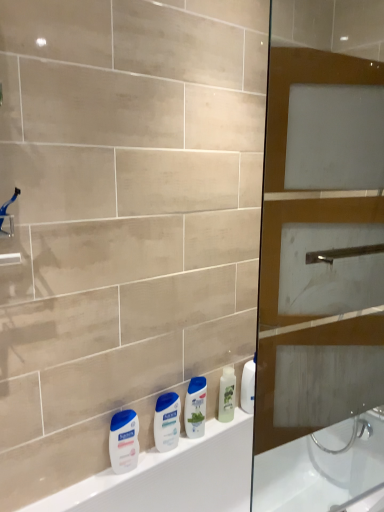
Measure the distance between point (342, 231) and camera.

Point (342, 231) and camera are 4.87 feet apart.

This screenshot has width=384, height=512. What do you see at coordinates (320, 282) in the screenshot?
I see `brown glass screen door at right` at bounding box center [320, 282].

The width and height of the screenshot is (384, 512). What do you see at coordinates (8, 214) in the screenshot? I see `blue plastic shower head at upper left` at bounding box center [8, 214].

Measure the distance between point (199, 384) and camera.

Point (199, 384) is 5.03 feet from camera.

The image size is (384, 512). Describe the element at coordinates (227, 395) in the screenshot. I see `white glossy lotion at center, which is the third toiletry from left to right` at that location.

What do you see at coordinates (167, 421) in the screenshot? I see `white glossy lotion at center, arranged as the second toiletry when viewed from the right` at bounding box center [167, 421].

Locate an element on the screen. This screenshot has height=512, width=384. brown glass screen door at right is located at coordinates (320, 282).

What's the angular difference between blue glossy shampoo at center and brown glass screen door at right's facing directions?

8.45 degrees.

Considering their positions, is blue glossy shampoo at center located in front of or behind brown glass screen door at right?

Clearly, blue glossy shampoo at center is behind brown glass screen door at right.

In the image, there is a brown glass screen door at right. Identify the location of cleaning product below it (from the image's perspective). The image size is (384, 512). (195, 407).

Considering the positions of point (15, 187) and point (132, 442), is point (15, 187) closer or farther from the camera than point (132, 442)?

Point (15, 187) is positioned closer to the camera compared to point (132, 442).

Can you confirm if blue plastic shower head at upper left is shorter than white matte lotion at lower left, which ranks as the 1th toiletry in left-to-right order?

Indeed, blue plastic shower head at upper left has a lesser height compared to white matte lotion at lower left, which ranks as the 1th toiletry in left-to-right order.

From a real-world perspective, who is located lower, blue plastic shower head at upper left or white matte lotion at lower left, the 3th toiletry positioned from the right?

From a 3D spatial view, white matte lotion at lower left, the 3th toiletry positioned from the right, is below.

Find the location of a particular element. The image size is (384, 512). shower on the left of white matte lotion at lower left, which ranks as the first toiletry in front-to-back order is located at coordinates (8, 214).

Which is closer, (124,412) or (228,420)?

Clearly, point (124,412) is closer to the camera than point (228,420).

Between white matte lotion at lower left, the third toiletry when ordered from back to front, and white glossy lotion at center, which is the first toiletry from right to left, which one has smaller width?

white glossy lotion at center, which is the first toiletry from right to left, is thinner.

From a real-world perspective, is white matte lotion at lower left, the 3th toiletry positioned from the right, physically below white glossy lotion at center, which is the third toiletry in front-to-back order?

Yes.

Can you tell me how much white matte lotion at lower left, the third toiletry when ordered from back to front, and white glossy lotion at center, the first toiletry viewed from the back, differ in facing direction?

There is a 0.00145-degree angle between the facing directions of white matte lotion at lower left, the third toiletry when ordered from back to front, and white glossy lotion at center, the first toiletry viewed from the back.

Do you think blue glossy shampoo at center is within blue plastic shower head at upper left, or outside of it?

The correct answer is: outside.

Based on the photo, from a real-world perspective, relative to blue plastic shower head at upper left, is blue glossy shampoo at center vertically above or below?

In terms of real-world spatial position, blue glossy shampoo at center is below blue plastic shower head at upper left.

Is blue glossy shampoo at center positioned with its back to blue plastic shower head at upper left?

No, blue glossy shampoo at center is not facing the opposite direction of blue plastic shower head at upper left.

Is blue glossy shampoo at center shorter than blue plastic shower head at upper left?

In fact, blue glossy shampoo at center may be taller than blue plastic shower head at upper left.

Is white glossy lotion at center, which is the third toiletry from left to right, oriented towards white glossy lotion at center, which is counted as the 2th toiletry, starting from the back?

No, white glossy lotion at center, which is the third toiletry from left to right, is not oriented towards white glossy lotion at center, which is counted as the 2th toiletry, starting from the back.

Is white glossy lotion at center, which is the third toiletry in front-to-back order, directly adjacent to white glossy lotion at center, marked as the 2th toiletry in a front-to-back arrangement?

white glossy lotion at center, which is the third toiletry in front-to-back order, and white glossy lotion at center, marked as the 2th toiletry in a front-to-back arrangement, are not in contact.

From a real-world perspective, is white glossy lotion at center, which is the first toiletry from right to left, above or below white glossy lotion at center, marked as the 2th toiletry in a front-to-back arrangement?

From a real-world perspective, white glossy lotion at center, which is the first toiletry from right to left, is physically above white glossy lotion at center, marked as the 2th toiletry in a front-to-back arrangement.

In terms of height, does white glossy lotion at center, marked as the 2th toiletry in a front-to-back arrangement, look taller or shorter compared to brown glass screen door at right?

Clearly, white glossy lotion at center, marked as the 2th toiletry in a front-to-back arrangement, is shorter compared to brown glass screen door at right.

Does white glossy lotion at center, which appears as the 2th toiletry when viewed from the left, appear on the right side of brown glass screen door at right?

In fact, white glossy lotion at center, which appears as the 2th toiletry when viewed from the left, is to the left of brown glass screen door at right.

How different are the orientations of white glossy lotion at center, which appears as the 2th toiletry when viewed from the left, and brown glass screen door at right in degrees?

The angle between the facing direction of white glossy lotion at center, which appears as the 2th toiletry when viewed from the left, and the facing direction of brown glass screen door at right is 8.45 degrees.

Is white glossy lotion at center, which appears as the 2th toiletry when viewed from the left, oriented away from brown glass screen door at right?

That's not correct — white glossy lotion at center, which appears as the 2th toiletry when viewed from the left, is not looking away from brown glass screen door at right.

From a real-world perspective, which is physically below, brown glass screen door at right or white matte lotion at lower left, the third toiletry when ordered from back to front?

white matte lotion at lower left, the third toiletry when ordered from back to front, is physically lower.

In the image, is brown glass screen door at right on the left side or the right side of white matte lotion at lower left, which ranks as the first toiletry in front-to-back order?

From the image, it's evident that brown glass screen door at right is to the right of white matte lotion at lower left, which ranks as the first toiletry in front-to-back order.

What's the angular difference between brown glass screen door at right and white matte lotion at lower left, which ranks as the first toiletry in front-to-back order,'s facing directions?

8.45 degrees.

The image size is (384, 512). What are the coordinates of `screen door that is on the right side of blue glossy shampoo at center` in the screenshot? It's located at (320, 282).

Starting from the blue plastic shower head at upper left, which toiletry is the 1st one behind? Please provide its 2D coordinates.

[(124, 441)]

Based on their spatial positions, is white glossy lotion at center, which is the third toiletry in front-to-back order, or blue plastic shower head at upper left closer to brown glass screen door at right?

white glossy lotion at center, which is the third toiletry in front-to-back order, lies closer to brown glass screen door at right than the other object.

Estimate the real-world distances between objects in this image. Which object is closer to blue glossy shampoo at center, white glossy lotion at center, arranged as the second toiletry when viewed from the right, or blue plastic shower head at upper left?

white glossy lotion at center, arranged as the second toiletry when viewed from the right, is closer to blue glossy shampoo at center.

From the picture: When comparing their distances from brown glass screen door at right, does white matte lotion at lower left, which ranks as the first toiletry in front-to-back order, or white glossy lotion at center, arranged as the second toiletry when viewed from the right, seem further?

white matte lotion at lower left, which ranks as the first toiletry in front-to-back order.

From the image, which object appears to be farther from brown glass screen door at right, blue plastic shower head at upper left or white glossy lotion at center, which appears as the 2th toiletry when viewed from the left?

The object further to brown glass screen door at right is blue plastic shower head at upper left.

Looking at this image, which object lies further to the anchor point brown glass screen door at right, white matte lotion at lower left, the third toiletry when ordered from back to front, or blue glossy shampoo at center?

white matte lotion at lower left, the third toiletry when ordered from back to front, lies further to brown glass screen door at right than the other object.

Which object lies nearer to the anchor point brown glass screen door at right, white matte lotion at lower left, the third toiletry when ordered from back to front, or white glossy lotion at center, which is the third toiletry from left to right?

white glossy lotion at center, which is the third toiletry from left to right, is closer to brown glass screen door at right.

When comparing their distances from white glossy lotion at center, which is the third toiletry from left to right, does blue plastic shower head at upper left or blue glossy shampoo at center seem closer?

Among the two, blue glossy shampoo at center is located nearer to white glossy lotion at center, which is the third toiletry from left to right.

Which object lies further to the anchor point white matte lotion at lower left, the third toiletry when ordered from back to front, blue glossy shampoo at center or blue plastic shower head at upper left?

blue plastic shower head at upper left is positioned further to the anchor white matte lotion at lower left, the third toiletry when ordered from back to front.

Locate an element on the screen. cleaning product between blue plastic shower head at upper left and white matte lotion at lower left, which ranks as the 1th toiletry in left-to-right order, vertically is located at coordinates (195, 407).

What are the coordinates of `toiletry between blue plastic shower head at upper left and blue glossy shampoo at center in the up-down direction` in the screenshot? It's located at (227, 395).

Find the location of a particular element. This screenshot has width=384, height=512. cleaning product situated between blue plastic shower head at upper left and brown glass screen door at right from left to right is located at coordinates (195, 407).

At what (x,y) coordinates should I click in order to perform the action: click on cleaning product between white glossy lotion at center, which appears as the 2th toiletry when viewed from the left, and white glossy lotion at center, which is the first toiletry from right to left, from left to right. Please return your answer as a coordinate pair (x, y). The height and width of the screenshot is (512, 384). Looking at the image, I should click on (195, 407).